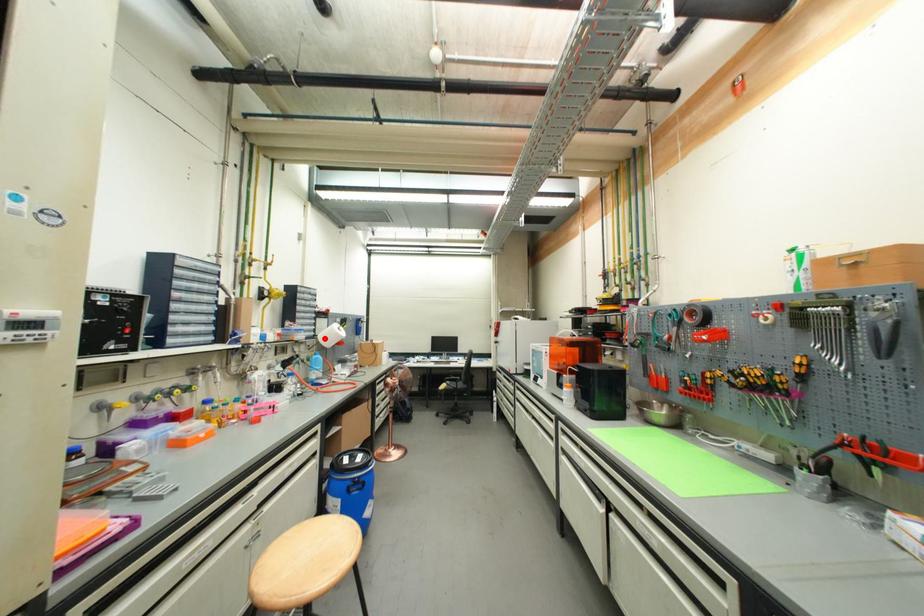
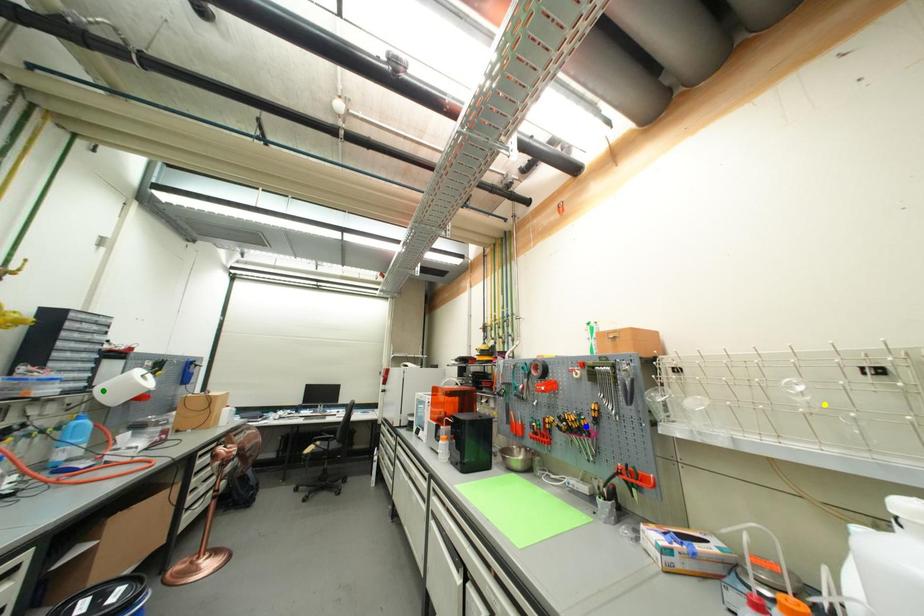
Question: I am providing you with two images of the same scene from different viewpoints. A red point is marked on the first image. You are given multiple points on the second image. In image 2, which mark is for the same physical point as the one in image 1?

Choices:
 (A) yellow point
 (B) blue point
 (C) green point

Answer: (C)